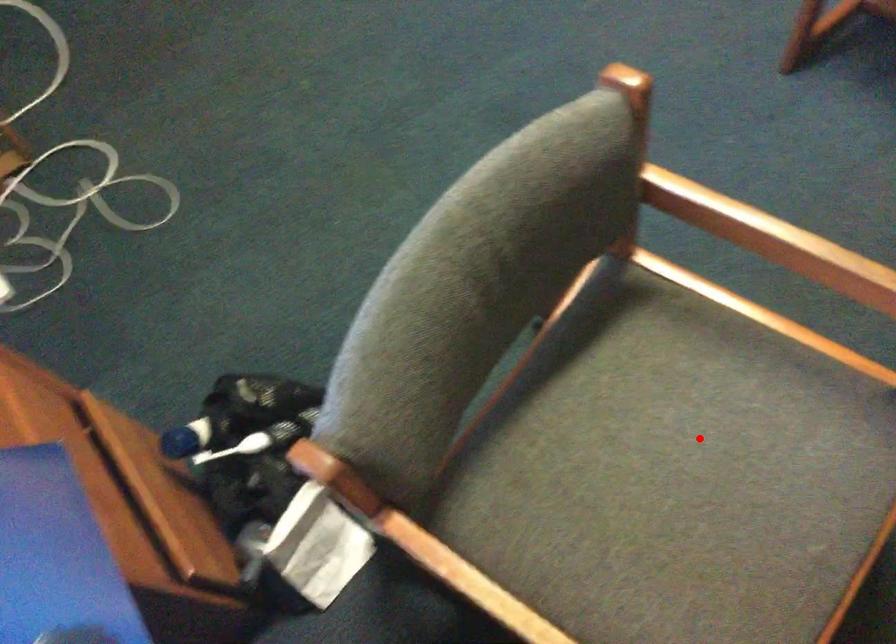
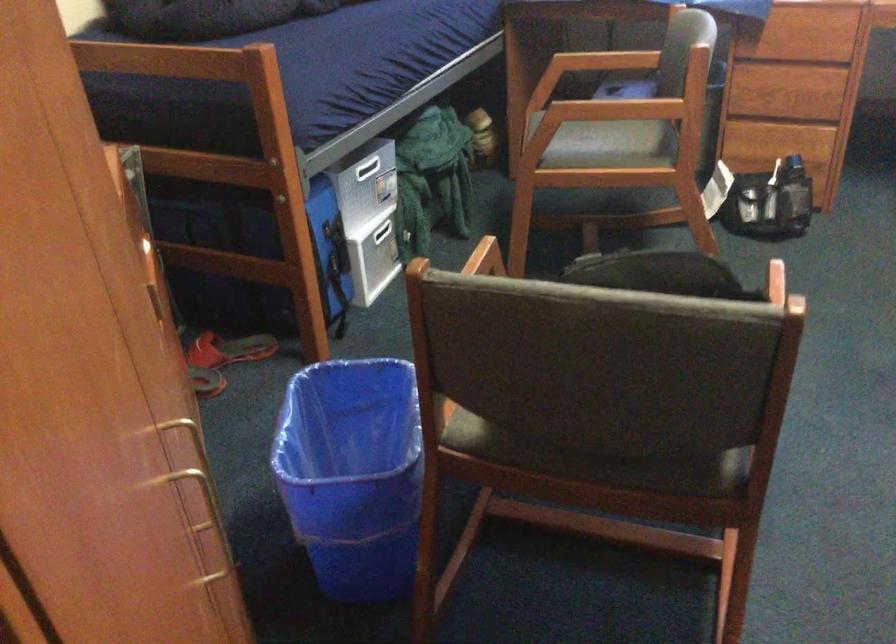
Question: I am providing you with two images of the same scene from different viewpoints. Image1 has a red point marked. In image2, the corresponding 3D location appears at what relative position? Reply with the corresponding letter.

Choices:
 (A) Closer
 (B) Farther

Answer: (B)